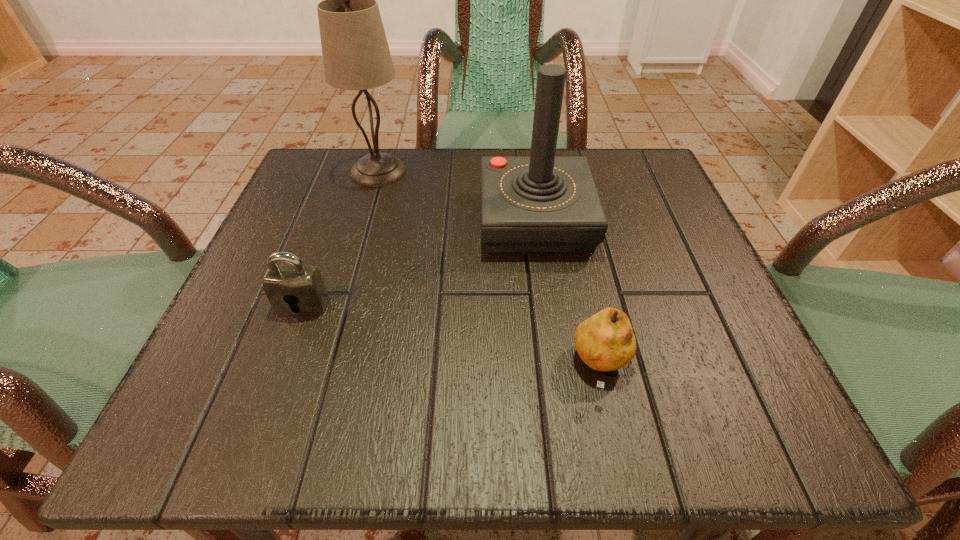
The image size is (960, 540). Identify the location of empty space that is in between the second tallest object and the tallest object. (457, 196).

Find the location of `vacant region between the nearest object and the tallest object`. vacant region between the nearest object and the tallest object is located at coordinates (491, 269).

What are the coordinates of `empty space that is in between the nearest object and the padlock` in the screenshot? It's located at (452, 336).

Locate an element on the screen. This screenshot has width=960, height=540. empty location between the pear and the joystick is located at coordinates (568, 294).

Identify the location of object that is the second nearest to the nearest object. (302, 286).

You are a GUI agent. You are given a task and a screenshot of the screen. Output one action in this format:
    pyautogui.click(x=<x>, y=<y>)
    Task: Click on the object that is the second nearest to the lampshade
    This screenshot has height=540, width=960.
    Given the screenshot: What is the action you would take?
    pyautogui.click(x=302, y=286)

Where is `free space that satisfies the following two spatial constraints: 1. at the front of the pear near the keyhole; 2. on the left side of the padlock`? free space that satisfies the following two spatial constraints: 1. at the front of the pear near the keyhole; 2. on the left side of the padlock is located at coordinates (279, 368).

Find the location of `vacant region that satisfies the following two spatial constraints: 1. on the front-facing side of the tallest object; 2. on the left side of the pear`. vacant region that satisfies the following two spatial constraints: 1. on the front-facing side of the tallest object; 2. on the left side of the pear is located at coordinates (322, 368).

Where is `free point that satisfies the following two spatial constraints: 1. on the front-facing side of the lampshade; 2. at the front of the padlock near the keyhole`? Image resolution: width=960 pixels, height=540 pixels. free point that satisfies the following two spatial constraints: 1. on the front-facing side of the lampshade; 2. at the front of the padlock near the keyhole is located at coordinates (340, 305).

You are a GUI agent. You are given a task and a screenshot of the screen. Output one action in this format:
    pyautogui.click(x=<x>, y=<y>)
    Task: Click on the free space that satisfies the following two spatial constraints: 1. on the front-facing side of the nearest object; 2. on the right side of the lampshade
    The image size is (960, 540).
    Given the screenshot: What is the action you would take?
    pyautogui.click(x=322, y=368)